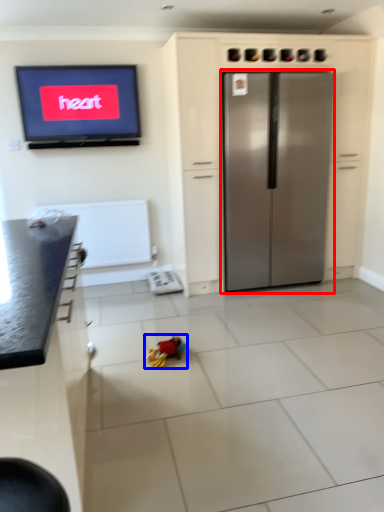
Question: Which point is closer to the camera, refrigerator (highlighted by a red box) or toy (highlighted by a blue box)?

Choices:
 (A) refrigerator
 (B) toy

Answer: (B)